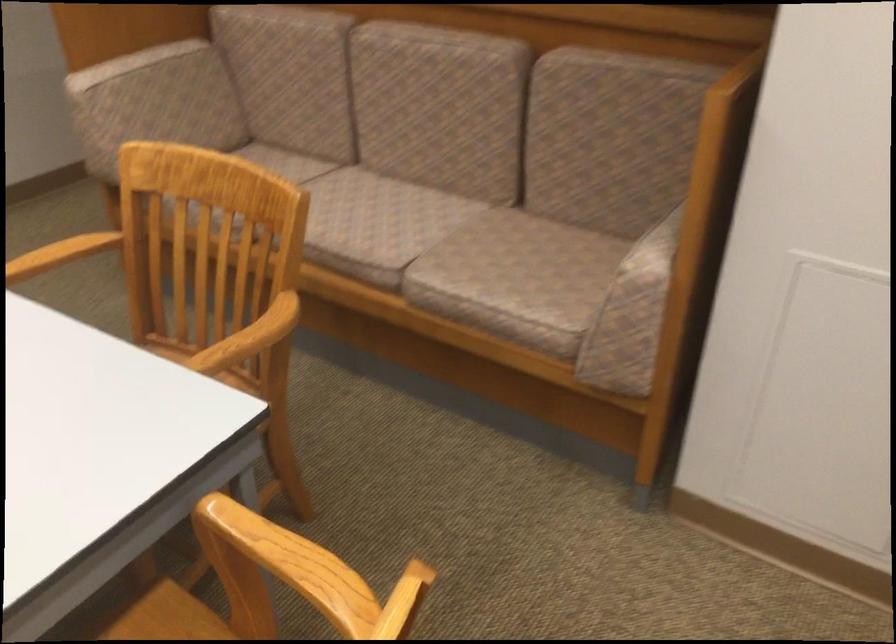
This screenshot has width=896, height=644. What do you see at coordinates (378, 223) in the screenshot?
I see `the upholstered sofa sitting surface` at bounding box center [378, 223].